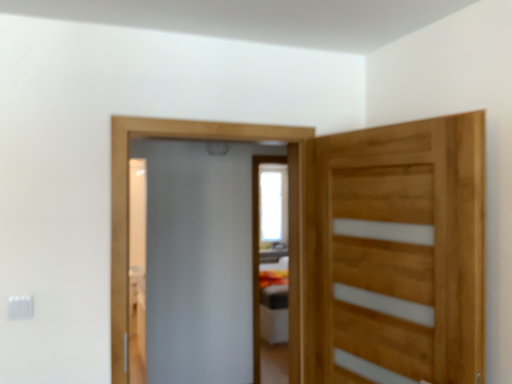
Question: Does point (260, 160) appear closer or farther from the camera than point (360, 337)?

Choices:
 (A) farther
 (B) closer

Answer: (A)

Question: Looking at the image, does white glossy screen door at center, the second screen door positioned from the front, seem bigger or smaller compared to natural wood door at right?

Choices:
 (A) big
 (B) small

Answer: (A)

Question: Estimate the real-world distances between objects in this image. Which object is closer to the frosted glass screen door at center, the second screen door from the back?

Choices:
 (A) white glossy screen door at center, the second screen door positioned from the front
 (B) natural wood door at right

Answer: (A)

Question: Which of these objects is positioned closest to the natural wood door at right?

Choices:
 (A) frosted glass screen door at center, the 1th screen door positioned from the front
 (B) white glossy screen door at center, the second screen door positioned from the front

Answer: (A)